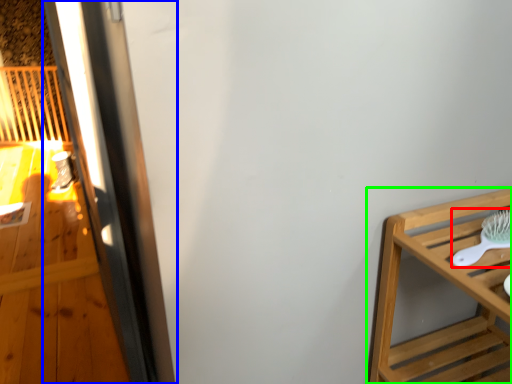
Question: Based on their relative distances, which object is nearer to brush (highlighted by a red box)? Choose from screen door (highlighted by a blue box) and furniture (highlighted by a green box).

Choices:
 (A) screen door
 (B) furniture

Answer: (B)